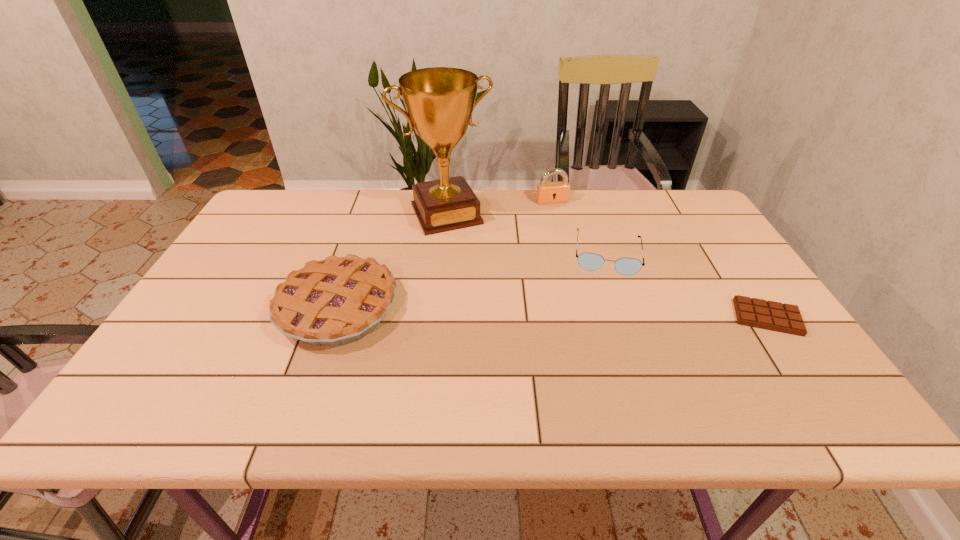
Image resolution: width=960 pixels, height=540 pixels. Identify the location of object located at the right edge. (786, 318).

At what (x,y) coordinates should I click in order to perform the action: click on vacant space at the far edge of the desktop. Please return your answer as a coordinate pair (x, y). The image size is (960, 540). Looking at the image, I should click on (351, 207).

Locate an element on the screen. The width and height of the screenshot is (960, 540). vacant space at the near edge of the desktop is located at coordinates (583, 353).

In the image, there is a desktop. Identify the location of free space at the left edge. Image resolution: width=960 pixels, height=540 pixels. (255, 266).

Locate an element on the screen. vacant region at the right edge is located at coordinates (759, 298).

The width and height of the screenshot is (960, 540). I want to click on vacant space at the far left corner, so click(x=284, y=204).

Where is `free space at the near left corner of the desktop`? The height and width of the screenshot is (540, 960). free space at the near left corner of the desktop is located at coordinates (177, 354).

Where is `free space between the spectacles and the padlock`? free space between the spectacles and the padlock is located at coordinates (580, 227).

In order to click on free spot between the padlock and the award in this screenshot , I will do `click(499, 207)`.

This screenshot has height=540, width=960. I want to click on unoccupied area between the pie and the shortest object, so click(553, 313).